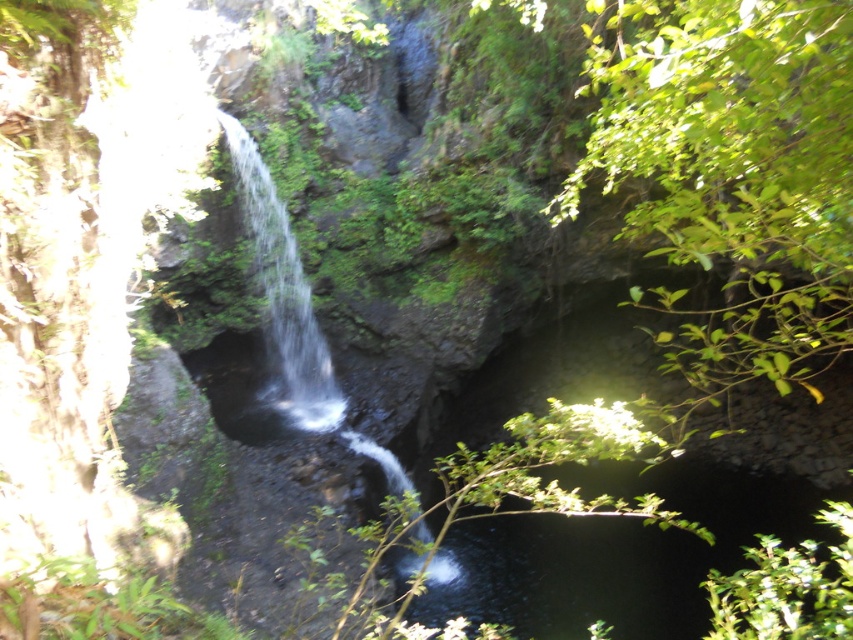
Does point (708, 20) come behind point (338, 422)?

No, (708, 20) is in front of (338, 422).

Does green leafy bush at lower right appear over clear water at center?

Indeed, green leafy bush at lower right is positioned over clear water at center.

Between point (767, 300) and point (236, 161), which one is positioned in front?

Positioned in front is point (767, 300).

Find the location of a particular element. Image resolution: width=853 pixels, height=640 pixels. green leafy bush at lower right is located at coordinates (733, 170).